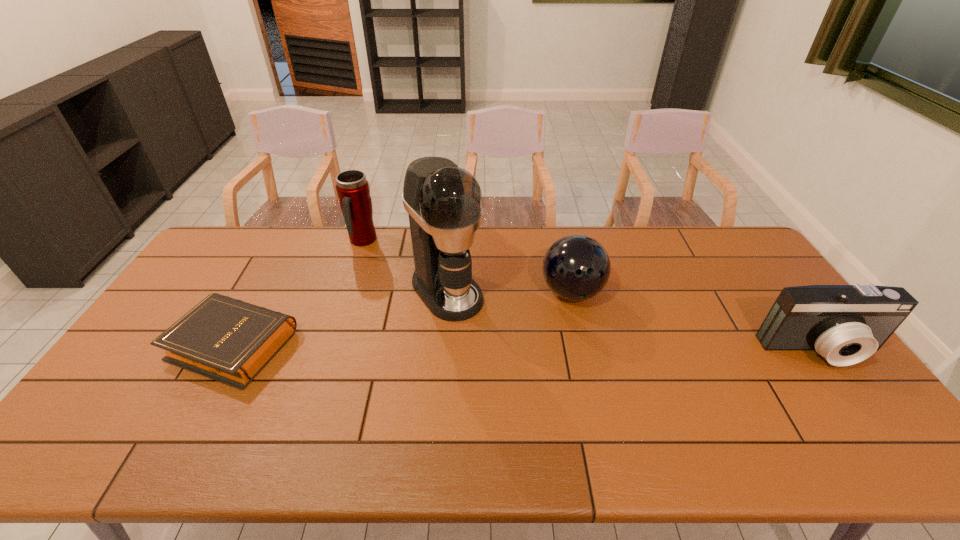
The width and height of the screenshot is (960, 540). I want to click on free space between the thermos bottle and the leftmost object, so click(299, 293).

Locate an element on the screen. This screenshot has width=960, height=540. free space between the camcorder and the fourth object from left to right is located at coordinates (697, 321).

This screenshot has width=960, height=540. I want to click on free space between the rightmost object and the shortest object, so click(528, 347).

The height and width of the screenshot is (540, 960). In order to click on free spot between the camcorder and the coffee maker in this screenshot , I will do `click(635, 321)`.

Where is `vacant area between the coffee maker and the camcorder`? This screenshot has width=960, height=540. vacant area between the coffee maker and the camcorder is located at coordinates (635, 321).

You are a GUI agent. You are given a task and a screenshot of the screen. Output one action in this format:
    pyautogui.click(x=<x>, y=<y>)
    Task: Click on the vacant space in between the shortest object and the rightmost object
    Image resolution: width=960 pixels, height=540 pixels.
    Given the screenshot: What is the action you would take?
    pyautogui.click(x=528, y=347)

This screenshot has width=960, height=540. Identify the location of empty location between the rightmost object and the bowling ball. (697, 321).

Choose which object is the third nearest neighbor to the camcorder. Please provide its 2D coordinates. Your answer should be formatted as a tuple, i.e. [(x, y)], where the tuple contains the x and y coordinates of a point satisfying the conditions above.

[(352, 188)]

Locate which object ranks fourth in proximity to the second object from right to left. Please provide its 2D coordinates. Your answer should be formatted as a tuple, i.e. [(x, y)], where the tuple contains the x and y coordinates of a point satisfying the conditions above.

[(228, 340)]